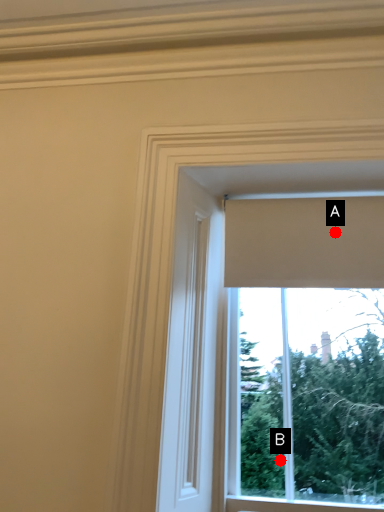
Question: Two points are circled on the image, labeled by A and B beside each circle. Which point is closer to the camera?

Choices:
 (A) A is closer
 (B) B is closer

Answer: (B)